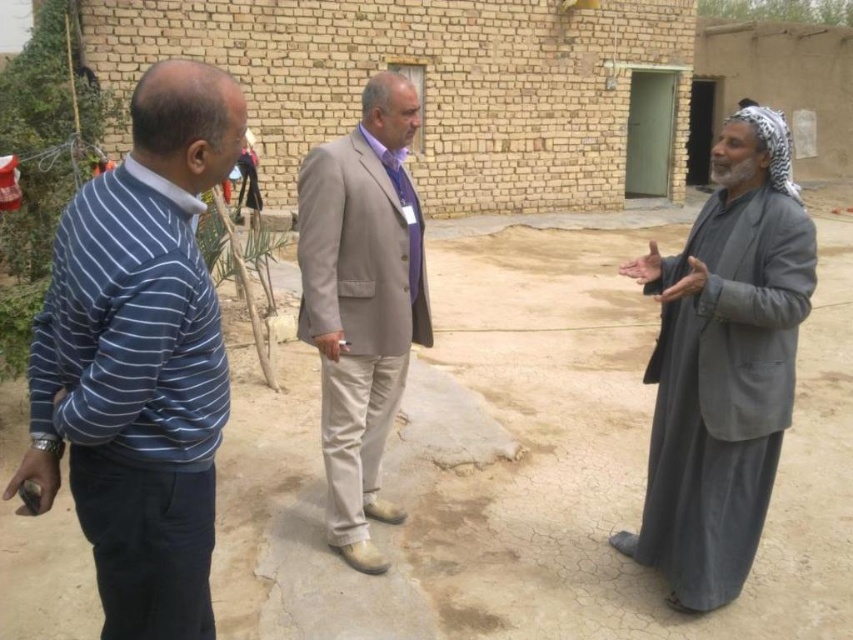
Is blue striped sweater at left above gray woolen robe at right?

No.

I want to click on blue striped sweater at left, so click(140, 358).

You are a GUI agent. You are given a task and a screenshot of the screen. Output one action in this format:
    pyautogui.click(x=<x>, y=<y>)
    Task: Click on the blue striped sweater at left
    The width and height of the screenshot is (853, 640).
    Given the screenshot: What is the action you would take?
    pyautogui.click(x=140, y=358)

Between point (595, 369) and point (346, 209), which one is positioned in front?

Point (346, 209)

The image size is (853, 640). Describe the element at coordinates (531, 467) in the screenshot. I see `dull brown dirt at center` at that location.

What do you see at coordinates (531, 467) in the screenshot? I see `dull brown dirt at center` at bounding box center [531, 467].

This screenshot has height=640, width=853. I want to click on dull brown dirt at center, so click(x=531, y=467).

Is point (357, 604) positioned after point (167, 93)?

Yes, it is behind point (167, 93).

Who is positioned more to the right, dull brown dirt at center or blue striped sweater at left?

dull brown dirt at center is more to the right.

Is point (267, 499) farther from camera compared to point (177, 602)?

Yes, point (267, 499) is farther from viewer.

This screenshot has height=640, width=853. Find the location of `dull brown dirt at center`. dull brown dirt at center is located at coordinates (531, 467).